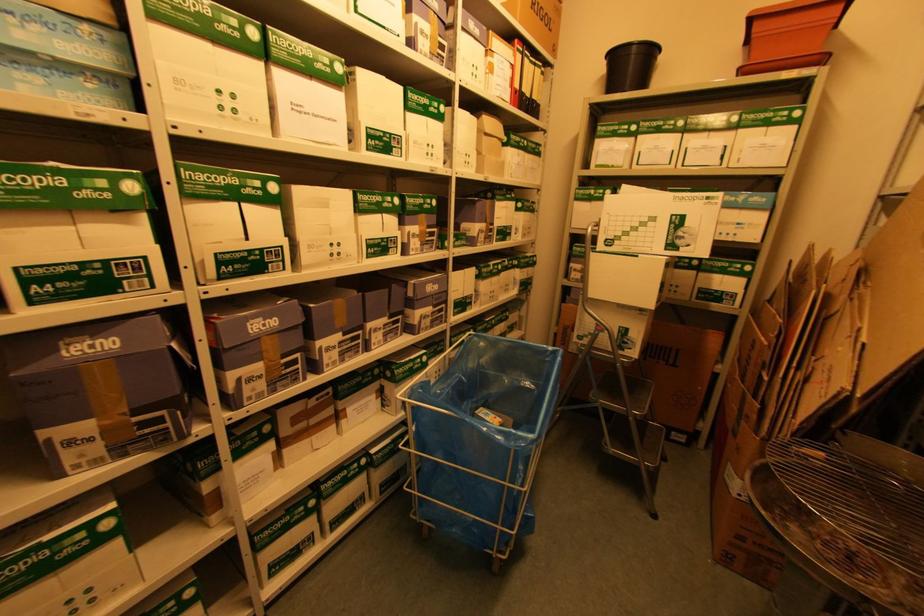
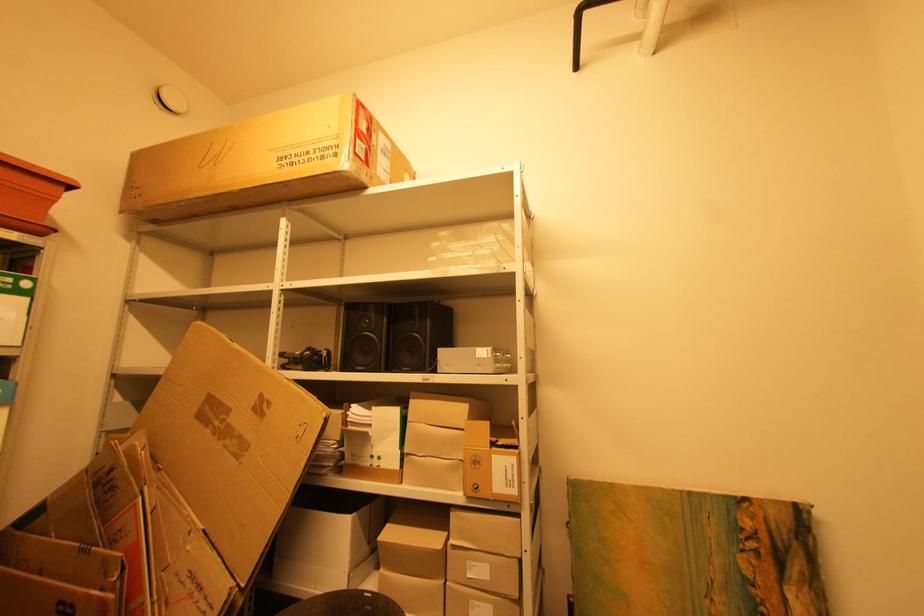
Question: Based on the continuous images, in which direction is the camera rotating? Reply with the corresponding letter.

Choices:
 (A) Left
 (B) Right
 (C) Up
 (D) Down

Answer: (B)